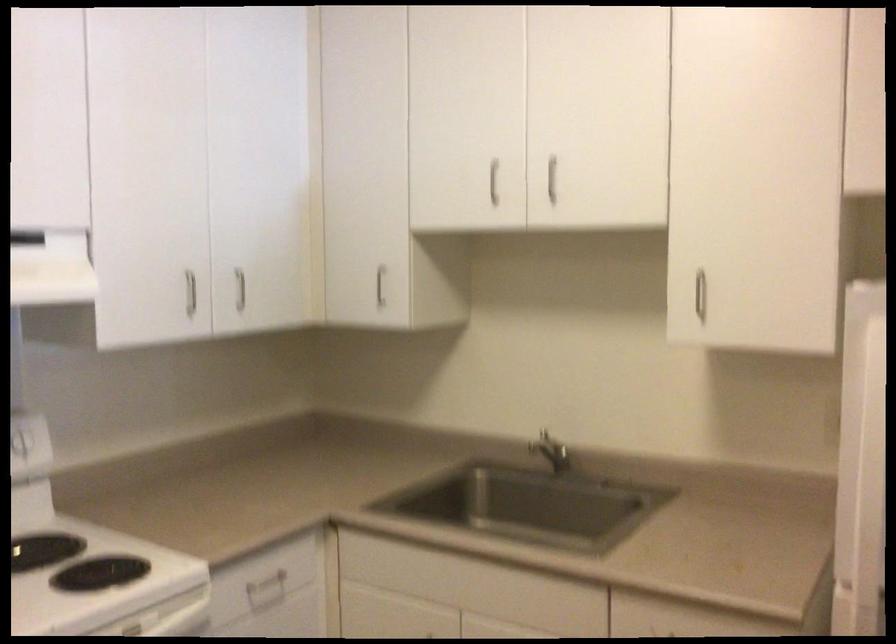
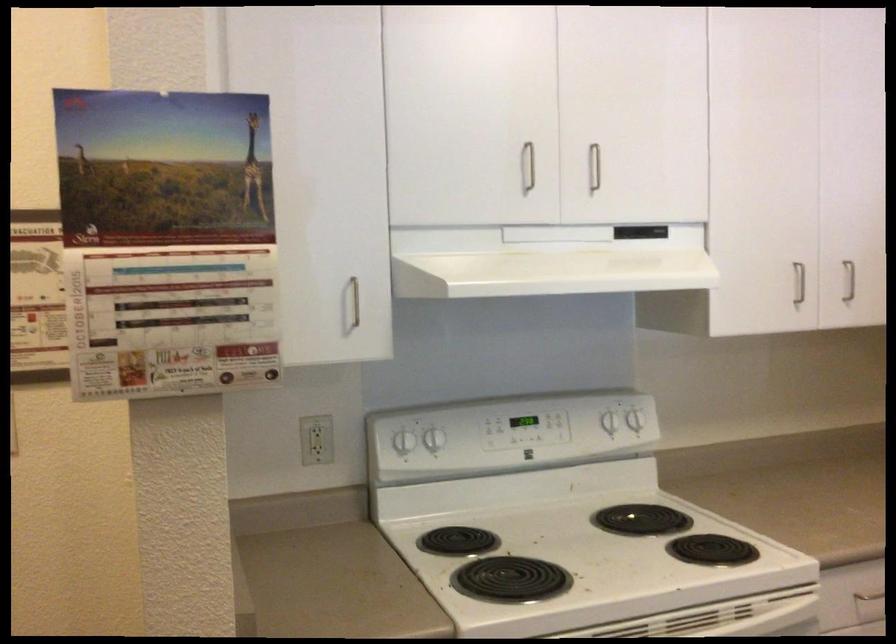
In the second image, find the point that corresponds to point (236, 285) in the first image.

(849, 281)